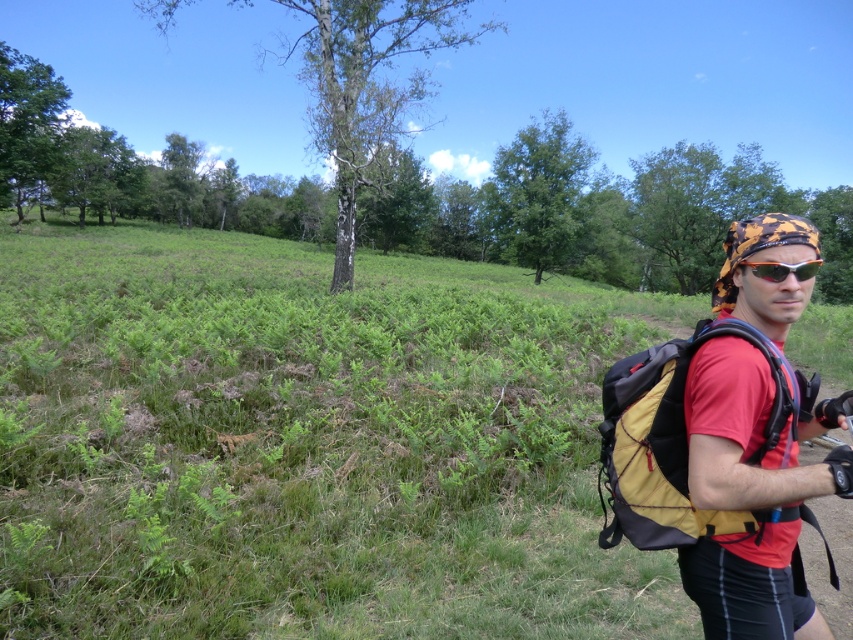
Question: Can you confirm if red fabric bandana at right is positioned above orange plastic goggles at center?

Choices:
 (A) yes
 (B) no

Answer: (B)

Question: Which of the following is the farthest from the observer?

Choices:
 (A) (x=787, y=484)
 (B) (x=247, y=317)
 (C) (x=720, y=529)

Answer: (B)

Question: Which is farther from the orange plastic goggles at center?

Choices:
 (A) red fabric bandana at right
 (B) green grassy at center
 (C) yellow fabric backpack at right

Answer: (B)

Question: Which point appears closest to the camera in this image?

Choices:
 (A) (473, 538)
 (B) (785, 323)
 (C) (817, 268)
 (D) (680, 474)

Answer: (D)

Question: Is green grassy at center thinner than yellow fabric backpack at right?

Choices:
 (A) yes
 (B) no

Answer: (B)

Question: In this image, where is green grassy at center located relative to orange plastic goggles at center?

Choices:
 (A) above
 (B) below

Answer: (A)